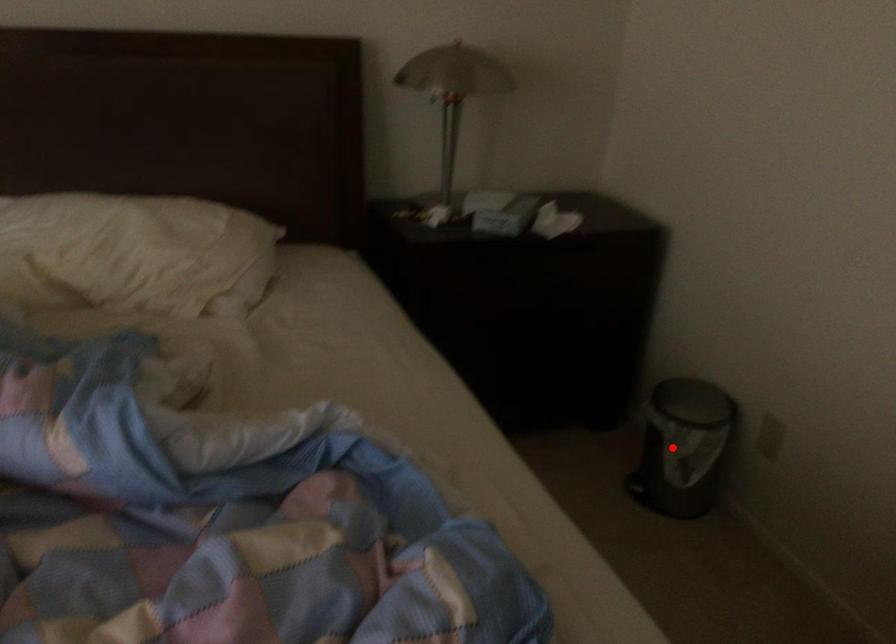
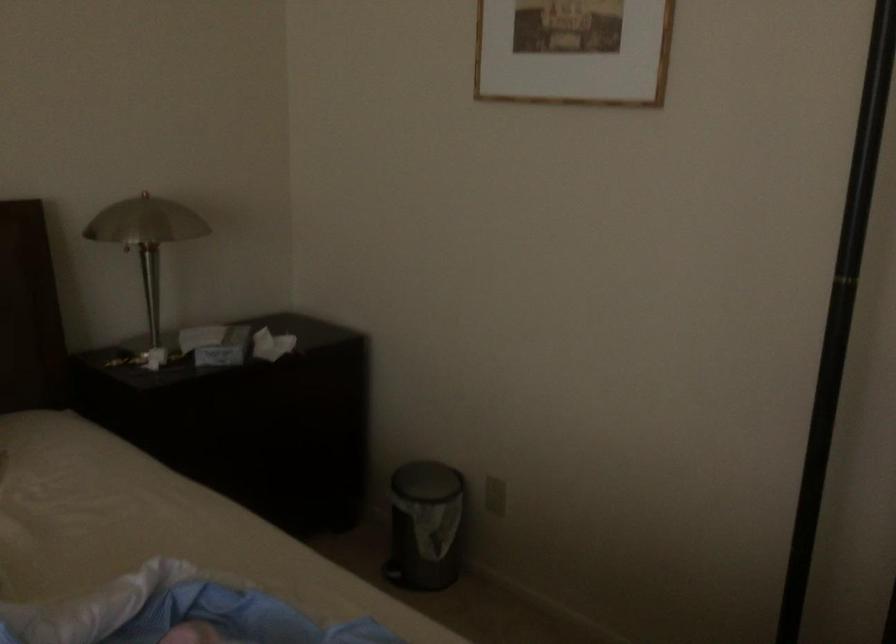
Find the pixel in the second image that matches the highlighted location in the first image.

(425, 526)